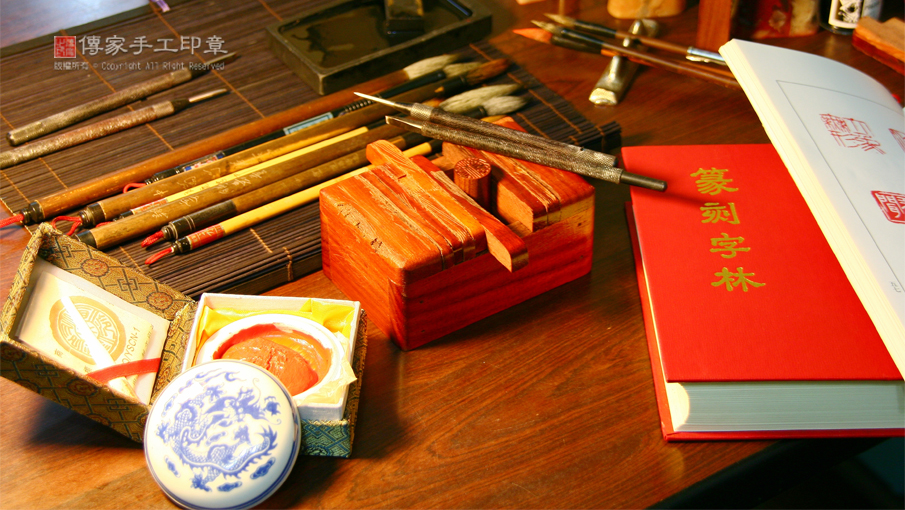
This screenshot has width=905, height=510. I want to click on white pages of book, so (x=814, y=194).